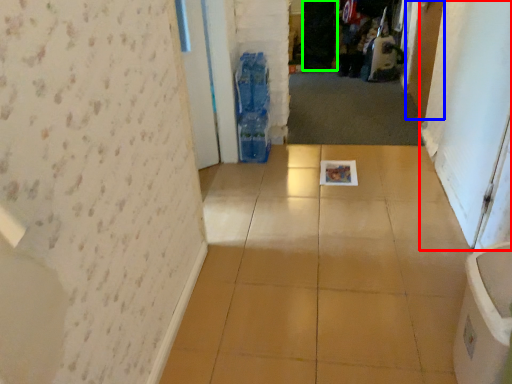
Question: Based on their relative distances, which object is nearer to screen door (highlighted by a red box)? Choose from door (highlighted by a blue box) and screen door (highlighted by a green box).

Choices:
 (A) door
 (B) screen door

Answer: (A)